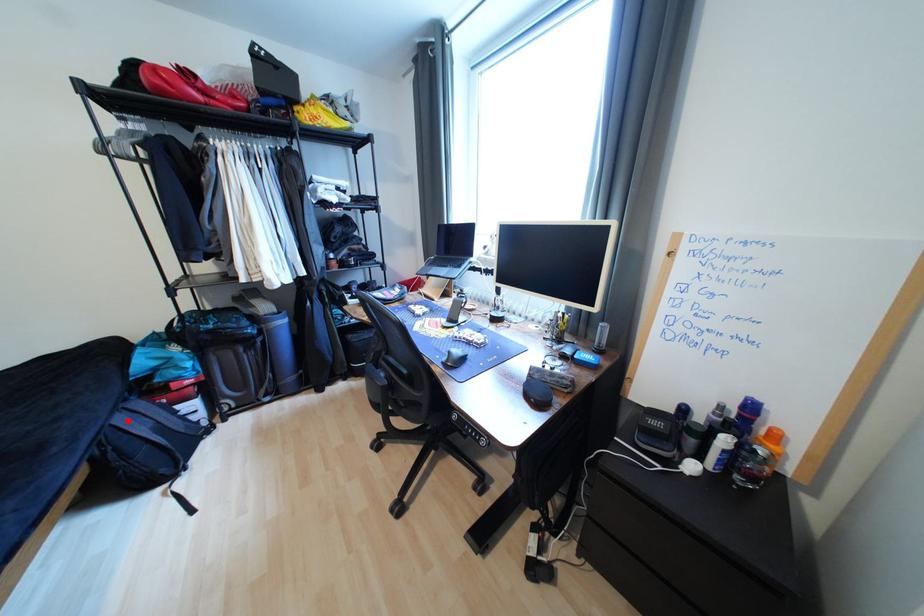
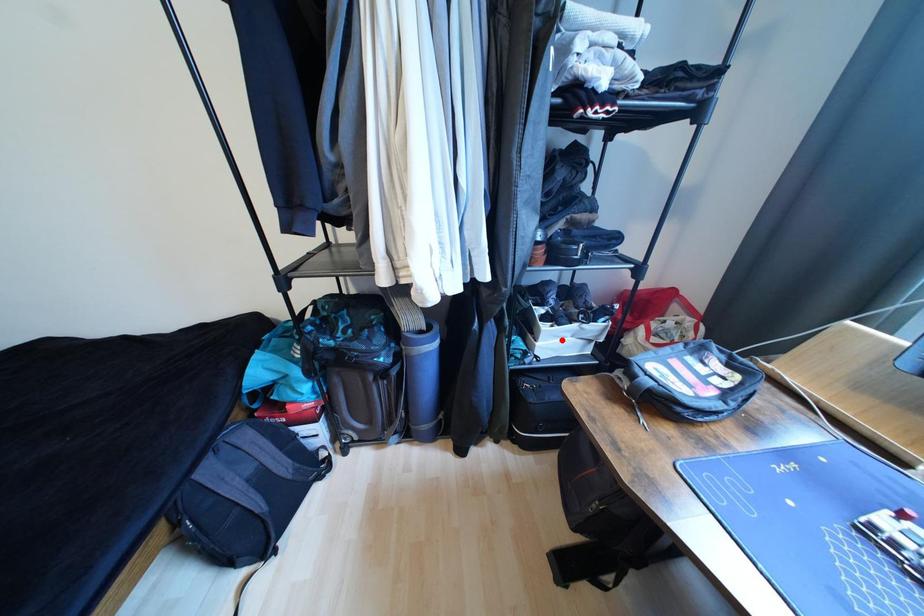
I am providing you with two images of the same scene from different viewpoints. A red point is marked on the first image and another point is marked on the second image. Is the marked point in image1 the same physical position as the marked point in image2?

No